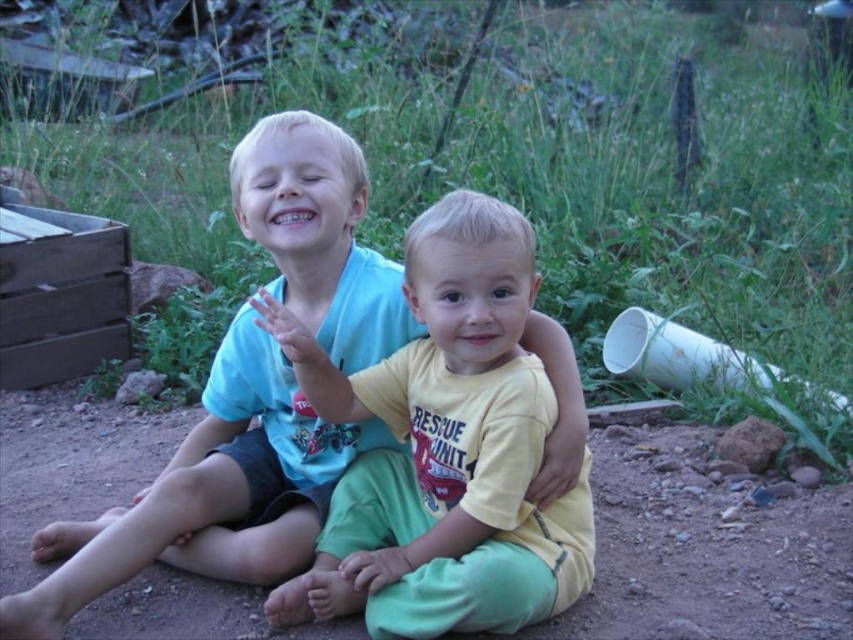
Looking at this image, you are a photographer trying to capture the two children in the scene. You notice the yellow cotton shirt at center and the brown dirt at center. Which object is located more to the left in the image?

The yellow cotton shirt at center is positioned on the left side of brown dirt at center, so it is more to the left.

Based on the scene description, which object is smaller in size between the yellow cotton shirt at center and the brown dirt at center?

The yellow cotton shirt at center has a smaller size compared to the brown dirt at center.